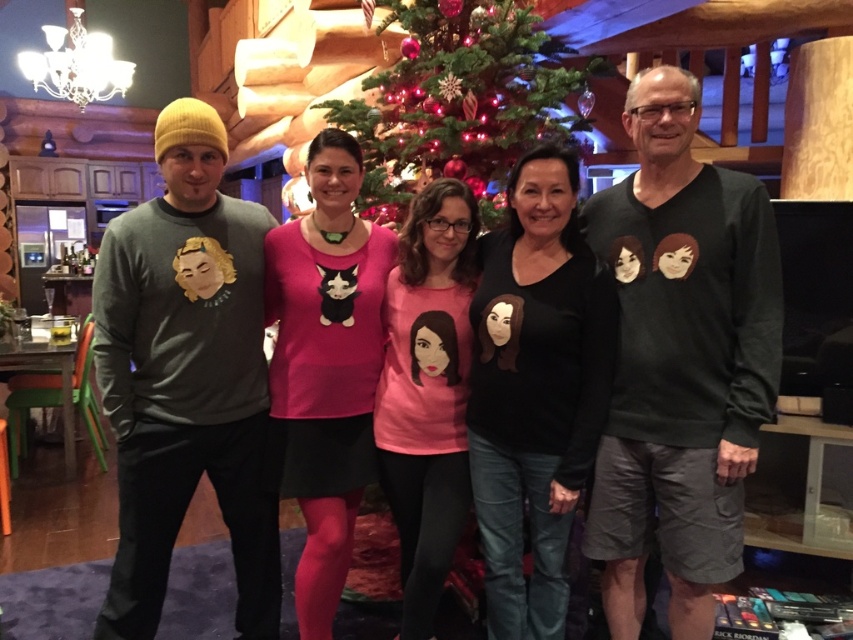
Can you confirm if pink matte sweater at center is positioned below green matte christmas tree at center?

Yes, pink matte sweater at center is below green matte christmas tree at center.

Between pink matte sweater at center and green matte christmas tree at center, which one is positioned higher?

Positioned higher is green matte christmas tree at center.

Does point (325, 515) come in front of point (495, 120)?

Yes, point (325, 515) is closer to viewer.

At what (x,y) coordinates should I click in order to perform the action: click on pink matte sweater at center. Please return your answer as a coordinate pair (x, y). This screenshot has height=640, width=853. Looking at the image, I should click on (325, 365).

Does dark gray sweater at left appear on the right side of green matte christmas tree at center?

Yes, dark gray sweater at left is to the right of green matte christmas tree at center.

Identify the location of dark gray sweater at left. The width and height of the screenshot is (853, 640). (680, 362).

Can you confirm if dark gray sweater at left is positioned to the right of pink matte shirt at center?

Correct, you'll find dark gray sweater at left to the right of pink matte shirt at center.

Can you confirm if dark gray sweater at left is bigger than pink matte shirt at center?

Indeed, dark gray sweater at left has a larger size compared to pink matte shirt at center.

I want to click on dark gray sweater at left, so click(680, 362).